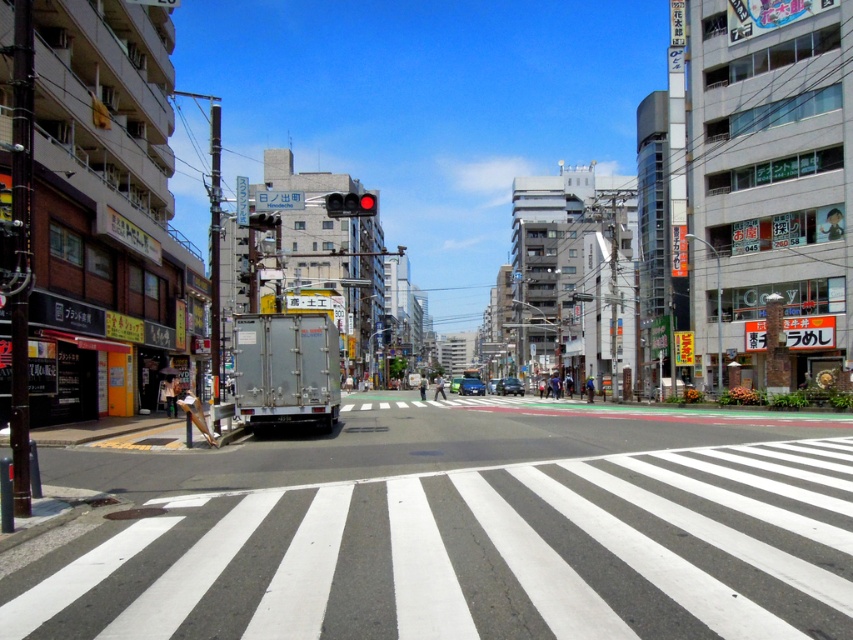
Between white asphalt crosswalk at center and red glass traffic light at center, which one appears on the left side from the viewer's perspective?

Positioned to the left is red glass traffic light at center.

Does white asphalt crosswalk at center appear under red glass traffic light at center?

Yes.

Does point (788, 518) lie behind point (350, 211)?

No, it is not.

Identify the location of white asphalt crosswalk at center. Image resolution: width=853 pixels, height=640 pixels. tap(469, 556).

Is point (753, 492) farther from camera compared to point (258, 220)?

No, (753, 492) is closer to viewer.

The image size is (853, 640). What do you see at coordinates (469, 556) in the screenshot?
I see `white asphalt crosswalk at center` at bounding box center [469, 556].

At what (x,y) coordinates should I click in order to perform the action: click on white asphalt crosswalk at center. Please return your answer as a coordinate pair (x, y). The width and height of the screenshot is (853, 640). Looking at the image, I should click on 469,556.

Between white asphalt crosswalk at center and matte black car at center, which one appears on the left side from the viewer's perspective?

From the viewer's perspective, white asphalt crosswalk at center appears more on the left side.

Is white asphalt crosswalk at center above matte black car at center?

Yes, white asphalt crosswalk at center is above matte black car at center.

Which is in front, point (625, 538) or point (515, 387)?

Point (625, 538) is more forward.

Where is `white asphalt crosswalk at center`? The width and height of the screenshot is (853, 640). white asphalt crosswalk at center is located at coordinates (469, 556).